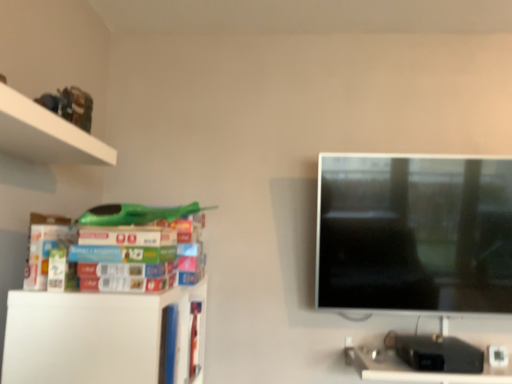
Question: Is matte plastic books at left positioned beyond the bounds of white matte shelf at lower left?

Choices:
 (A) yes
 (B) no

Answer: (A)

Question: From a real-world perspective, is matte plastic books at left below white matte shelf at lower left?

Choices:
 (A) yes
 (B) no

Answer: (B)

Question: Considering the relative positions of matte plastic books at left and white matte shelf at lower left in the image provided, is matte plastic books at left to the left of white matte shelf at lower left from the viewer's perspective?

Choices:
 (A) no
 (B) yes

Answer: (A)

Question: Is white matte shelf at lower left located within matte plastic books at left?

Choices:
 (A) no
 (B) yes

Answer: (A)

Question: Would you consider matte plastic books at left to be distant from white matte shelf at lower left?

Choices:
 (A) no
 (B) yes

Answer: (A)

Question: In terms of width, does matte plastic books at left look wider or thinner when compared to black plastic computer desk at lower right?

Choices:
 (A) wide
 (B) thin

Answer: (B)

Question: From the image's perspective, is matte plastic books at left located above or below black plastic computer desk at lower right?

Choices:
 (A) above
 (B) below

Answer: (A)

Question: Would you say matte plastic books at left is inside or outside black plastic computer desk at lower right?

Choices:
 (A) outside
 (B) inside

Answer: (A)

Question: In the image, is matte plastic books at left positioned in front of or behind black plastic computer desk at lower right?

Choices:
 (A) behind
 (B) front

Answer: (B)

Question: From their relative heights in the image, would you say matte plastic books at left is taller or shorter than white matte shelf at lower left?

Choices:
 (A) tall
 (B) short

Answer: (B)

Question: Considering the positions of point (24, 288) and point (181, 349), is point (24, 288) closer or farther from the camera than point (181, 349)?

Choices:
 (A) farther
 (B) closer

Answer: (B)

Question: Do you think matte plastic books at left is within white matte shelf at lower left, or outside of it?

Choices:
 (A) inside
 (B) outside

Answer: (B)

Question: Is matte plastic books at left in front of or behind white matte shelf at lower left in the image?

Choices:
 (A) behind
 (B) front

Answer: (B)

Question: Considering the positions of black plastic computer desk at lower right and white matte shelf at lower left in the image, is black plastic computer desk at lower right taller or shorter than white matte shelf at lower left?

Choices:
 (A) short
 (B) tall

Answer: (A)

Question: From a real-world perspective, is black plastic computer desk at lower right physically located above or below white matte shelf at lower left?

Choices:
 (A) above
 (B) below

Answer: (B)